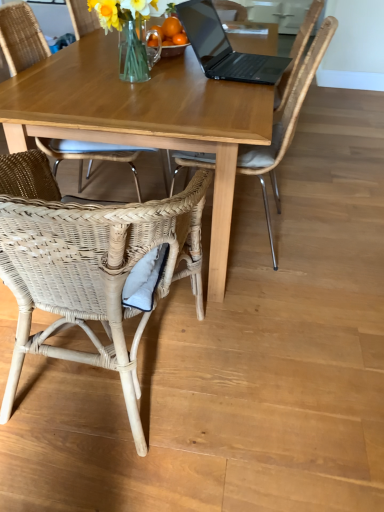
Where is `vacant area located to the right-hand side of woven rattan chair at lower left, arranged as the second chair when viewed from the right`? Image resolution: width=384 pixels, height=512 pixels. vacant area located to the right-hand side of woven rattan chair at lower left, arranged as the second chair when viewed from the right is located at coordinates (281, 380).